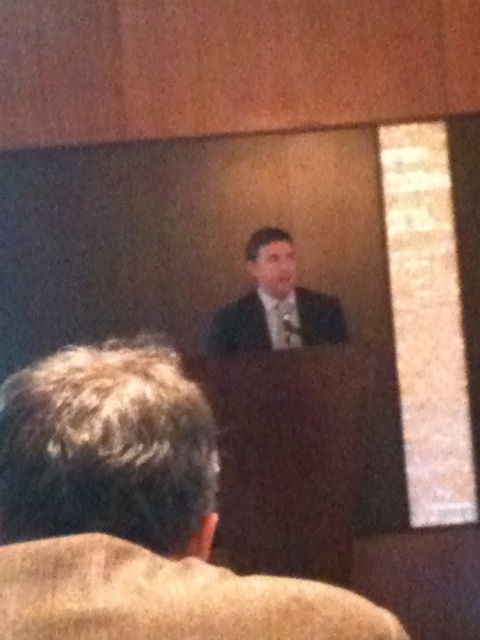
You are attending a presentation and want to know how far the point at coordinates point (83,570) is from your current position. Can you determine the distance?

→ The distance of point (83,570) from camera is 21.21 inches.

You are an event planner who needs to place a 6.5 feet wide banner between the dark suit at center and the matte black suit at center. Is there enough space?

The dark suit at center and matte black suit at center are 8.02 feet apart from each other, so yes, the banner can be placed between them as the distance is greater than the banner width.

You are sitting in the audience and want to look at both the speaker and the curtain. Which point, point (x=72, y=528) or point (x=264, y=272), is closer to you?

Point (x=72, y=528) is closer to the viewer than point (x=264, y=272).